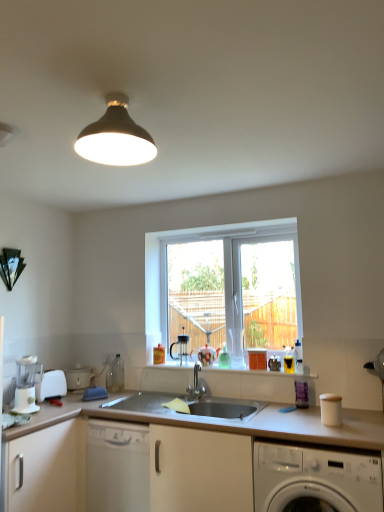
At what (x,y) coordinates should I click in order to perform the action: click on free space above matte black lampshade at upper center (from a real-world perspective). Please return your answer as a coordinate pair (x, y). This screenshot has width=384, height=512. Looking at the image, I should click on (118, 95).